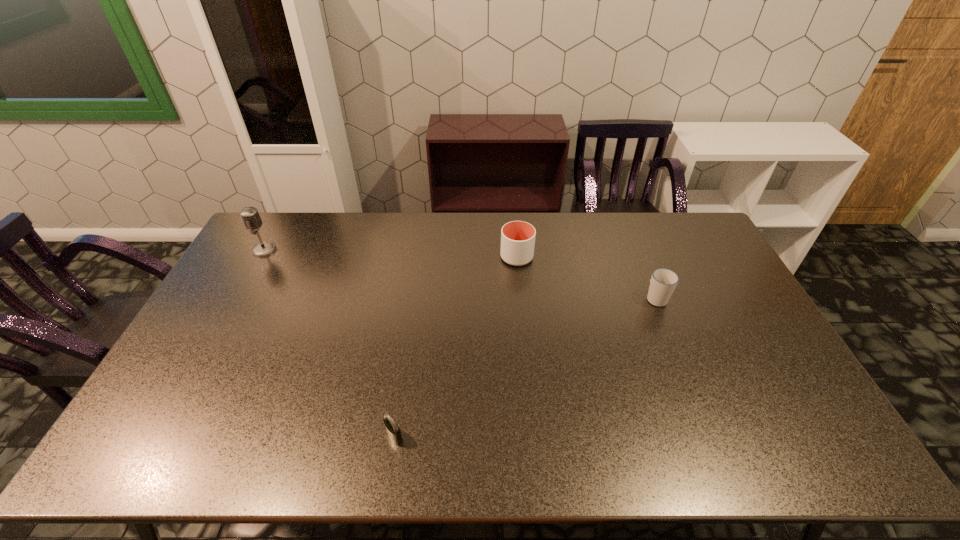
Identify the location of microphone. (250, 216).

This screenshot has height=540, width=960. In order to click on the tallest object in this screenshot , I will do `click(250, 216)`.

Image resolution: width=960 pixels, height=540 pixels. In order to click on the second object from right to left in this screenshot , I will do `click(517, 237)`.

Identify the location of the left cup. Image resolution: width=960 pixels, height=540 pixels. (517, 237).

The height and width of the screenshot is (540, 960). I want to click on the nearer cup, so click(663, 282).

Find the location of a particular element. The width and height of the screenshot is (960, 540). the right cup is located at coordinates (663, 282).

The width and height of the screenshot is (960, 540). Find the location of `the shortest object`. the shortest object is located at coordinates (393, 431).

The height and width of the screenshot is (540, 960). I want to click on padlock, so click(x=393, y=431).

You are a GUI agent. You are given a task and a screenshot of the screen. Output one action in this format:
    pyautogui.click(x=<x>, y=<y>)
    Task: Click on the free location located on the back of the tallest object
    
    Given the screenshot: What is the action you would take?
    pyautogui.click(x=276, y=228)

Locate an element on the screen. This screenshot has height=540, width=960. free space located on the front of the left cup is located at coordinates (524, 341).